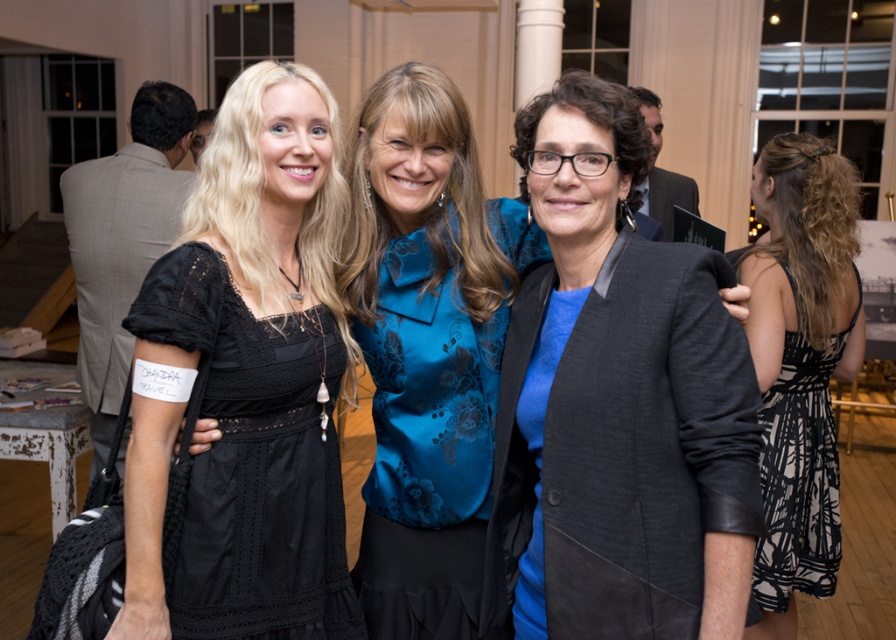
Can you confirm if blue satin blouse at center is wider than black printed fabric dress at right?

Indeed, blue satin blouse at center has a greater width compared to black printed fabric dress at right.

Between blue satin blouse at center and black printed fabric dress at right, which one is positioned higher?

blue satin blouse at center is higher up.

Which is behind, point (437, 352) or point (806, 563)?

Point (806, 563)

Locate an element on the screen. This screenshot has width=896, height=640. blue satin blouse at center is located at coordinates (433, 429).

Who is lower down, matte black blazer at center or black lace dress at center?

matte black blazer at center is lower down.

Is point (647, 292) farther from viewer compared to point (148, 602)?

No.

Is point (735, 371) positioned after point (296, 115)?

No, it is not.

Locate an element on the screen. The width and height of the screenshot is (896, 640). matte black blazer at center is located at coordinates (616, 406).

Which of these two, black lace dress at center or blue satin blouse at center, stands shorter?

Standing shorter between the two is blue satin blouse at center.

Can you confirm if black lace dress at center is positioned to the left of blue satin blouse at center?

Yes, black lace dress at center is to the left of blue satin blouse at center.

Describe the element at coordinates (248, 380) in the screenshot. The height and width of the screenshot is (640, 896). I see `black lace dress at center` at that location.

Identify the location of black lace dress at center. (248, 380).